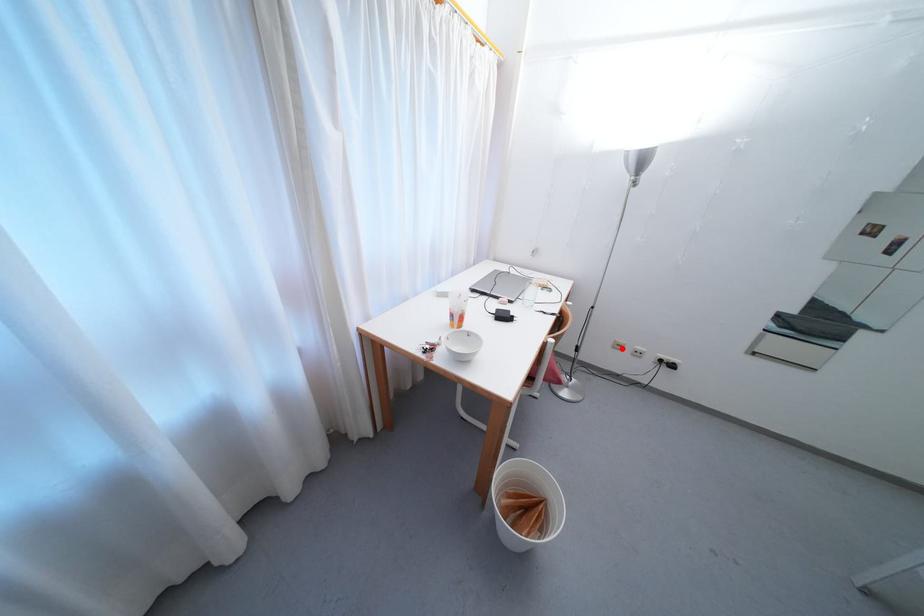
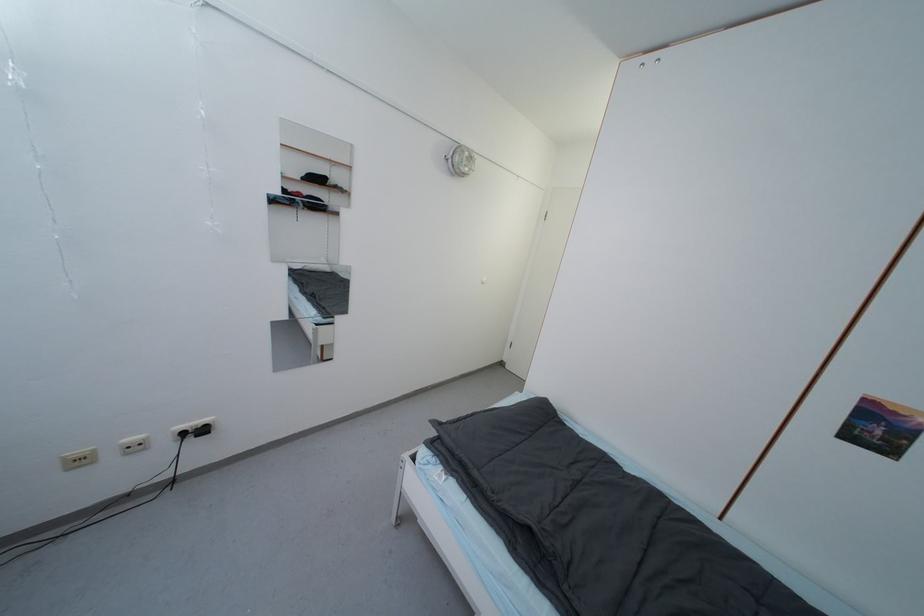
Question: I am providing you with two images of the same scene from different viewpoints. A red point is shown in image1. For the corresponding object point in image2, is it positioned nearer or farther from the camera?

Choices:
 (A) Nearer
 (B) Farther

Answer: (A)